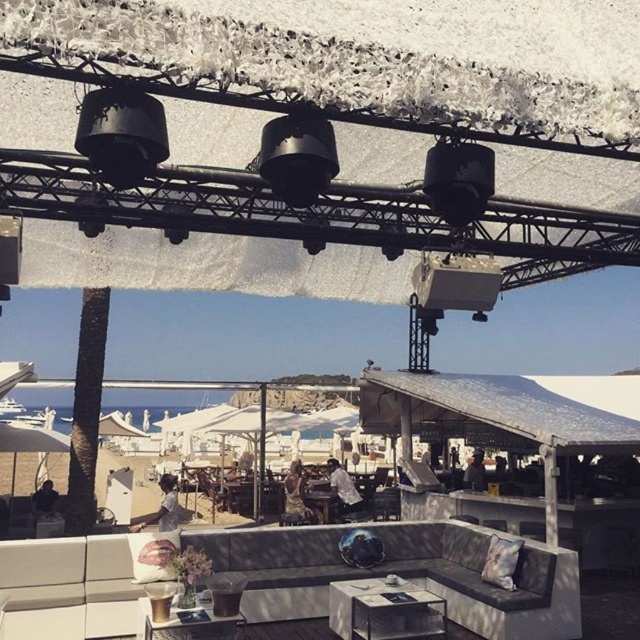
You are planning to host a small gathering and need to seat 4 people comfortably. You have a leather couch at center and a wooden chair at center available. Which piece of furniture can accommodate more people?

The leather couch at center can accommodate more people because its width surpasses that of the wooden chair at center.

You are standing at the wooden table at lower center and want to move to the leather couch at center. In which direction should you walk to reach it?

You should walk to your right to reach the leather couch at center, as it is located to the right of the wooden table at lower center.